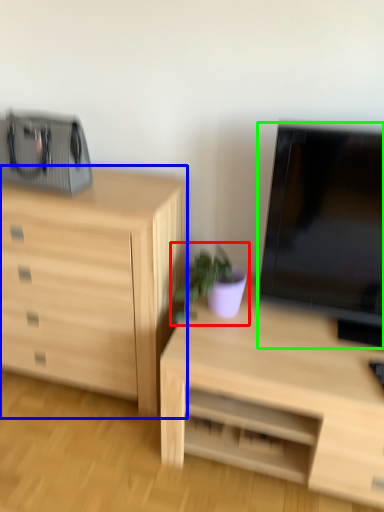
Question: Considering the real-world distances, which object is farthest from houseplant (highlighted by a red box)? chest of drawers (highlighted by a blue box) or television (highlighted by a green box)?

Choices:
 (A) chest of drawers
 (B) television

Answer: (A)